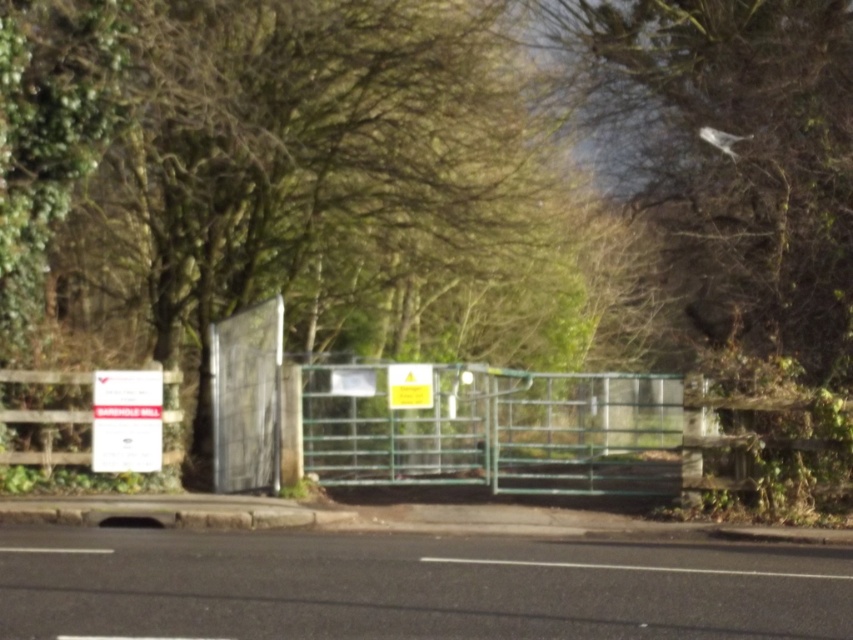
You are driving a car and need to pass through the green metal gate at center. However, there is a wooden fence at left blocking your path. Which direction should you move to go through the gate?

The green metal gate at center is positioned on the right side of the wooden fence at left, so you should move to the right side of the wooden fence at left to go through the gate.

From the picture: You are driving a truck that is 2.5 meters tall. You approach the green metal gate at center and see the wooden fence at left. Based on the scene, can your truck pass through the gate without hitting anything?

The green metal gate at center is taller than wooden fence at left. Since the truck is 2.5 meters tall and the gate is taller than the fence, but the exact height of the gate isn